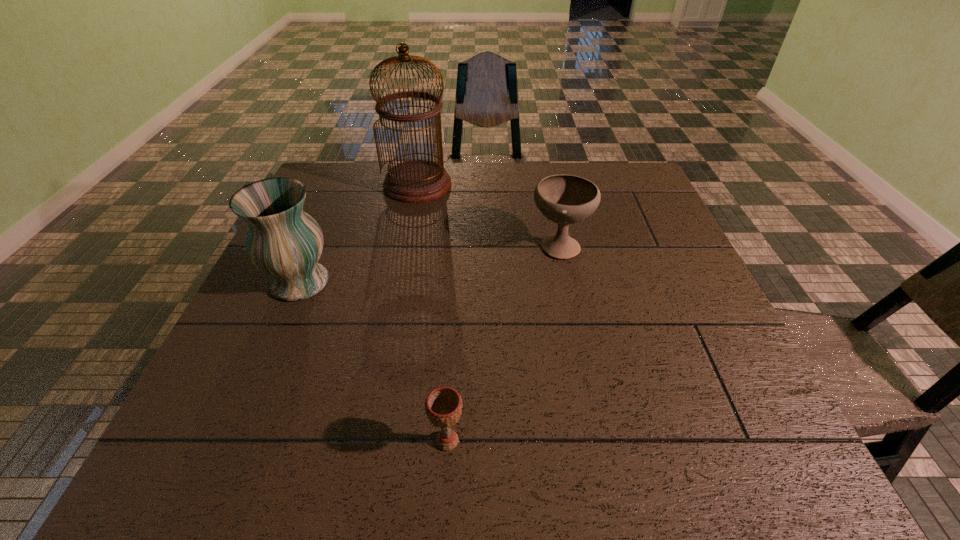
Where is `vacant space in between the farther chalice and the left chalice`? vacant space in between the farther chalice and the left chalice is located at coordinates (503, 343).

You are a GUI agent. You are given a task and a screenshot of the screen. Output one action in this format:
    pyautogui.click(x=<x>, y=<y>)
    Task: Click on the object that is the third closest to the vase
    The image size is (960, 540).
    Given the screenshot: What is the action you would take?
    pyautogui.click(x=564, y=199)

Locate an element on the screen. object that is the second closest to the leftmost object is located at coordinates (443, 406).

Locate an element on the screen. The image size is (960, 540). vacant region that satisfies the following two spatial constraints: 1. on the back side of the nearer chalice; 2. on the left side of the rightmost object is located at coordinates (459, 245).

This screenshot has width=960, height=540. Identify the location of free space that satisfies the following two spatial constraints: 1. on the back side of the leftmost object; 2. on the right side of the taller chalice. (316, 245).

At what (x,y) coordinates should I click in order to perform the action: click on vacant space that satisfies the following two spatial constraints: 1. on the front-facing side of the farthest object; 2. on the left side of the left chalice. Please return your answer as a coordinate pair (x, y). The image size is (960, 540). Looking at the image, I should click on (368, 441).

You are a GUI agent. You are given a task and a screenshot of the screen. Output one action in this format:
    pyautogui.click(x=<x>, y=<y>)
    Task: Click on the vacant space that satisfies the following two spatial constraints: 1. on the front-facing side of the second object from left to right; 2. on the right side of the left chalice
    
    Given the screenshot: What is the action you would take?
    pyautogui.click(x=368, y=441)

Where is `vacant region that satisfies the following two spatial constraints: 1. on the front-facing side of the farthest object; 2. on the right side of the rightmost object`? vacant region that satisfies the following two spatial constraints: 1. on the front-facing side of the farthest object; 2. on the right side of the rightmost object is located at coordinates (406, 245).

You are a GUI agent. You are given a task and a screenshot of the screen. Output one action in this format:
    pyautogui.click(x=<x>, y=<y>)
    Task: Click on the vacant region that satisfies the following two spatial constraints: 1. on the front-facing side of the shortest object; 2. on the left side of the tallest object
    
    Given the screenshot: What is the action you would take?
    pyautogui.click(x=368, y=441)